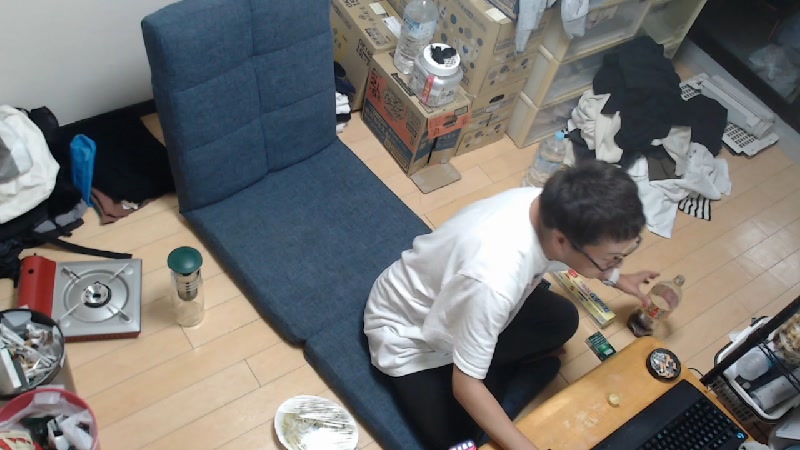
Identify the location of chair/sofa. (254, 77).